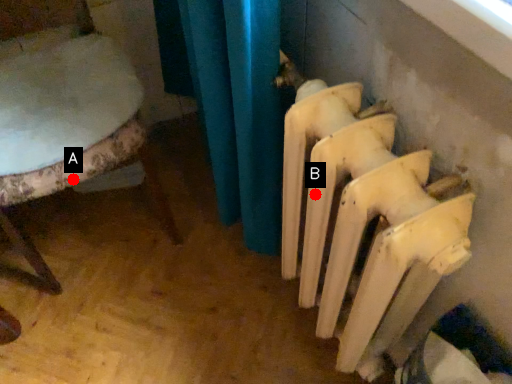
Question: Two points are circled on the image, labeled by A and B beside each circle. Which of the following is the farthest from the observer?

Choices:
 (A) A is further
 (B) B is further

Answer: (A)